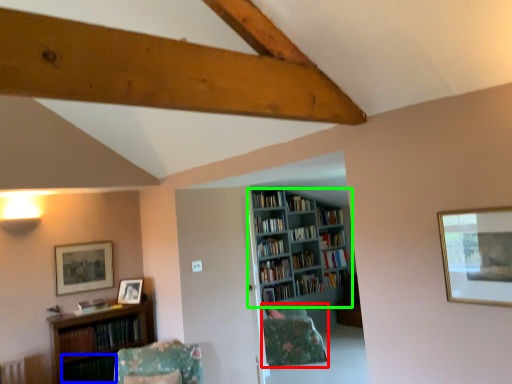
Question: Estimate the real-world distances between objects in this image. Which object is farther from pillow (highlighted by a red box), book (highlighted by a blue box) or bookcase (highlighted by a green box)?

Choices:
 (A) book
 (B) bookcase

Answer: (A)